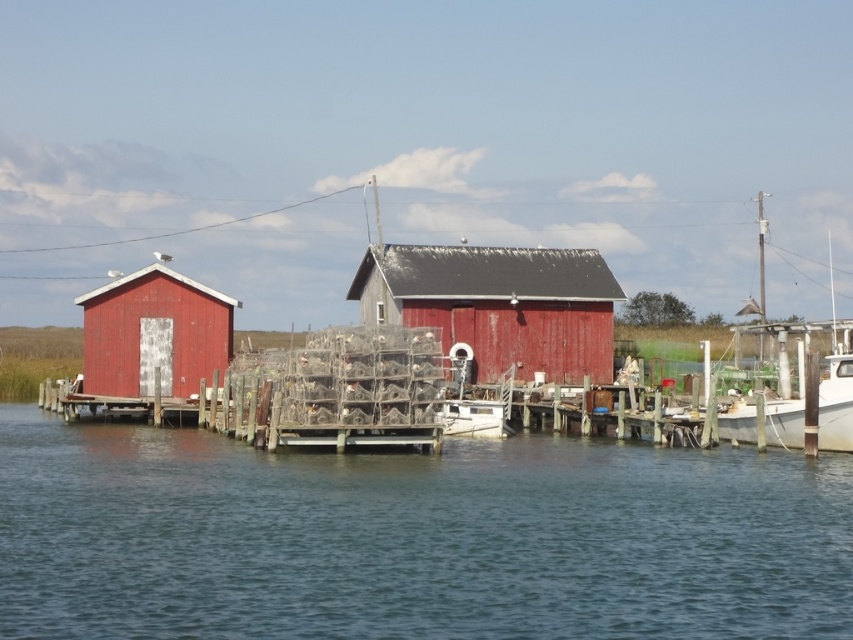
Between smooth wooden hut at left and white glossy boat at right, which one appears on the right side from the viewer's perspective?

Result: Positioned to the right is white glossy boat at right.

Consider the image. Does smooth wooden hut at left appear under white glossy boat at right?

Yes, smooth wooden hut at left is below white glossy boat at right.

Between point (91, 292) and point (752, 419), which one is positioned in front?

Point (752, 419)

Find the location of `smooth wooden hut at left`. smooth wooden hut at left is located at coordinates (154, 333).

Can you confirm if transparent water at center is bigger than smooth wooden hut at left?

Correct, transparent water at center is larger in size than smooth wooden hut at left.

Is transparent water at center wider than smooth wooden hut at left?

Yes, transparent water at center is wider than smooth wooden hut at left.

Is point (38, 522) farther from viewer compared to point (109, 378)?

No, (38, 522) is closer to viewer.

I want to click on transparent water at center, so click(x=413, y=538).

Is point (641, 467) positioned behind point (606, 346)?

No, (641, 467) is closer to viewer.

Find the location of a particular element. This screenshot has width=853, height=640. transparent water at center is located at coordinates (413, 538).